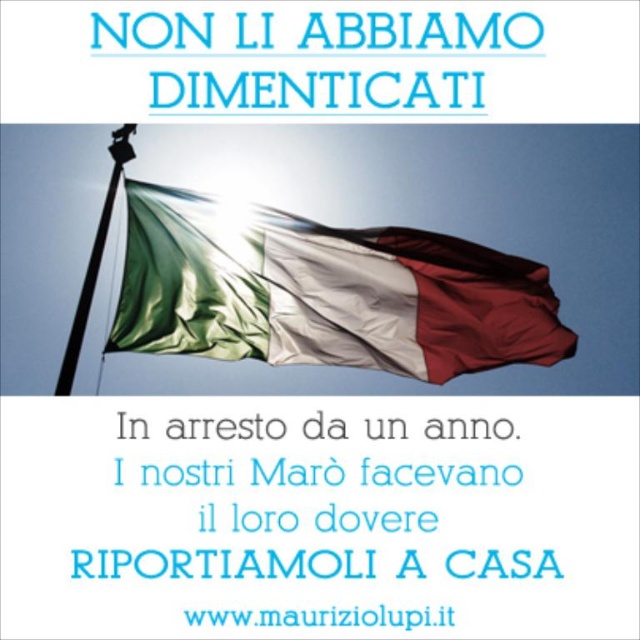
What do you see at coordinates (324, 292) in the screenshot? I see `silky fabric flag at center` at bounding box center [324, 292].

Is point (392, 308) positioned in front of point (128, 148)?

Yes, point (392, 308) is closer to viewer.

Locate an element on the screen. silky fabric flag at center is located at coordinates (324, 292).